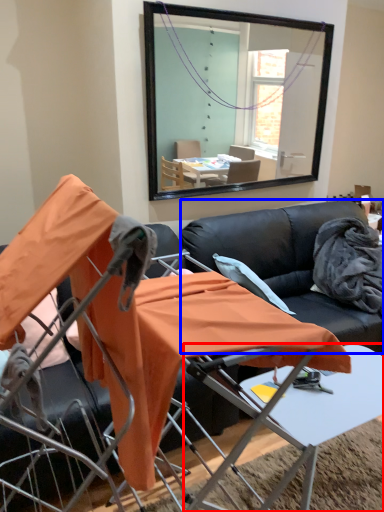
Question: Which object is further to the camera taking this photo, table (highlighted by a red box) or couch (highlighted by a blue box)?

Choices:
 (A) table
 (B) couch

Answer: (B)